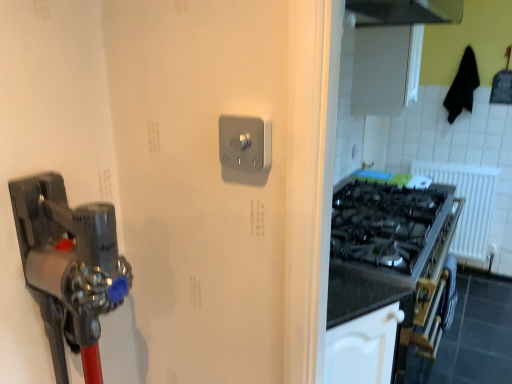
Question: From a real-world perspective, does white plastic radiator at right sit lower than satin silver switch at center?

Choices:
 (A) no
 (B) yes

Answer: (B)

Question: Is white plastic radiator at right beside satin silver switch at center?

Choices:
 (A) no
 (B) yes

Answer: (A)

Question: Does white plastic radiator at right have a larger size compared to satin silver switch at center?

Choices:
 (A) yes
 (B) no

Answer: (A)

Question: Is white plastic radiator at right oriented towards satin silver switch at center?

Choices:
 (A) no
 (B) yes

Answer: (B)

Question: From the image's perspective, is white plastic radiator at right below satin silver switch at center?

Choices:
 (A) yes
 (B) no

Answer: (A)

Question: Could satin silver switch at center be considered to be inside white plastic radiator at right?

Choices:
 (A) no
 (B) yes

Answer: (A)

Question: Does satin silver switch at center come behind white plastic radiator at right?

Choices:
 (A) no
 (B) yes

Answer: (A)

Question: Is satin silver switch at center positioned beyond the bounds of white plastic radiator at right?

Choices:
 (A) no
 (B) yes

Answer: (B)

Question: Is satin silver switch at center to the left of white plastic radiator at right from the viewer's perspective?

Choices:
 (A) yes
 (B) no

Answer: (A)

Question: From the image's perspective, does satin silver switch at center appear lower than white plastic radiator at right?

Choices:
 (A) yes
 (B) no

Answer: (B)

Question: From the image's perspective, is satin silver switch at center on white plastic radiator at right?

Choices:
 (A) no
 (B) yes

Answer: (B)

Question: Is satin silver switch at center turned away from white plastic radiator at right?

Choices:
 (A) yes
 (B) no

Answer: (A)

Question: Is white plastic radiator at right taller or shorter than satin silver switch at center?

Choices:
 (A) short
 (B) tall

Answer: (B)